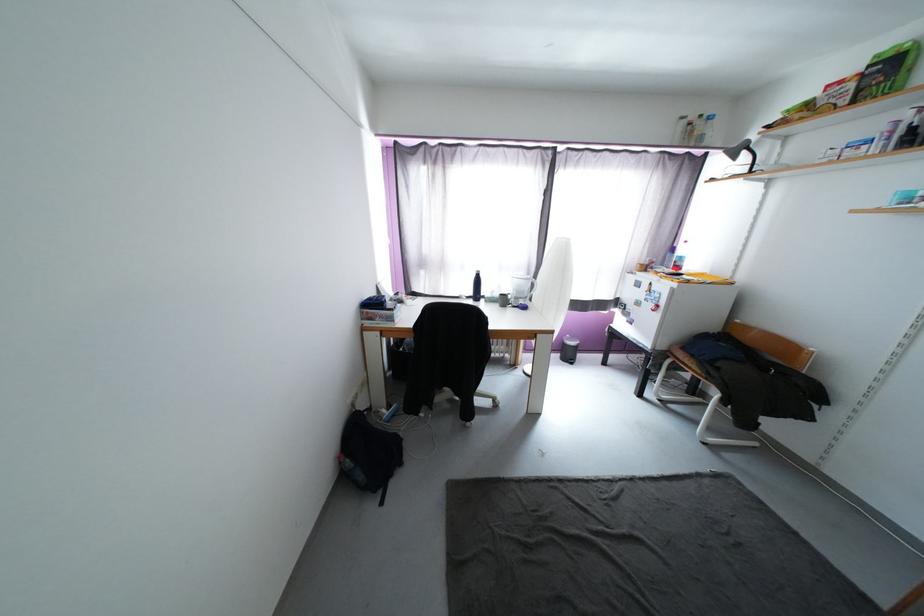
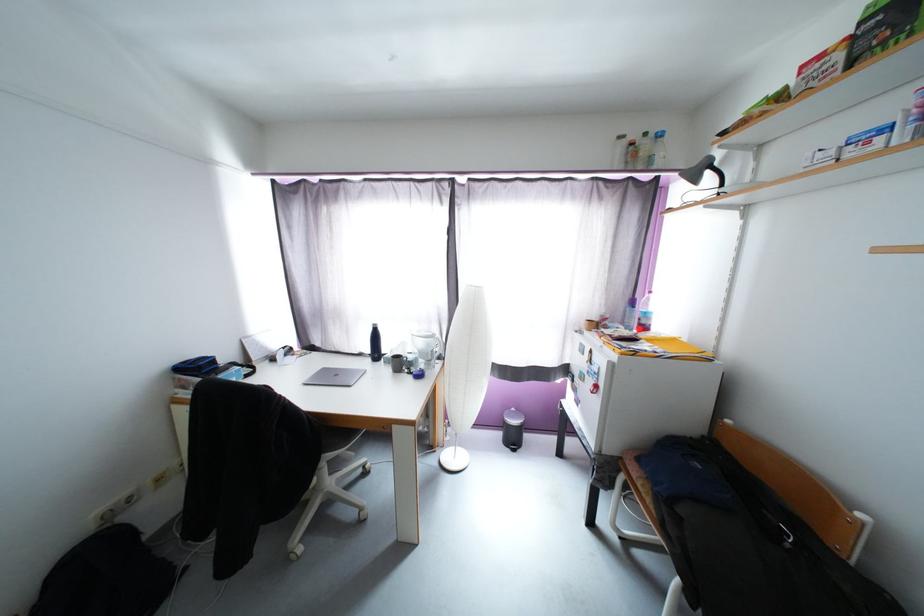
In the second image, find the point that corresponds to [675,256] in the first image.

(634, 310)